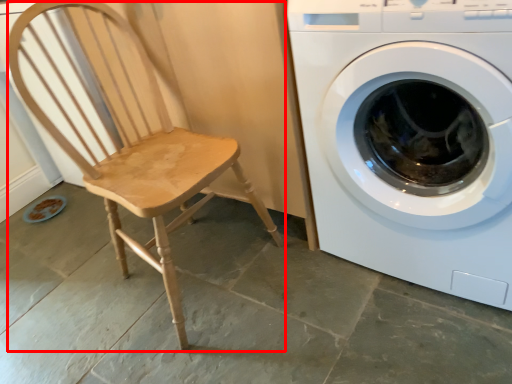
Question: From the image, what is the correct spatial relationship of rocking chair (annotated by the red box) in relation to washing machine?

Choices:
 (A) right
 (B) left

Answer: (B)